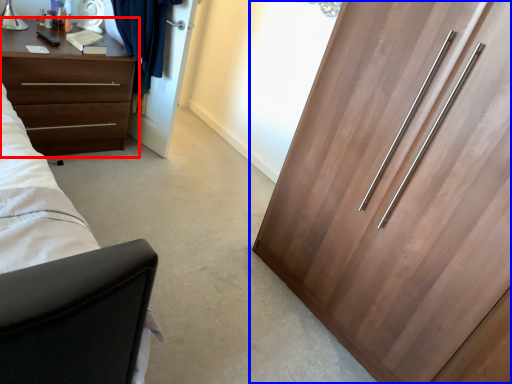
Question: Which object appears closest to the camera in this image, chest of drawers (highlighted by a red box) or cupboard (highlighted by a blue box)?

Choices:
 (A) chest of drawers
 (B) cupboard

Answer: (B)